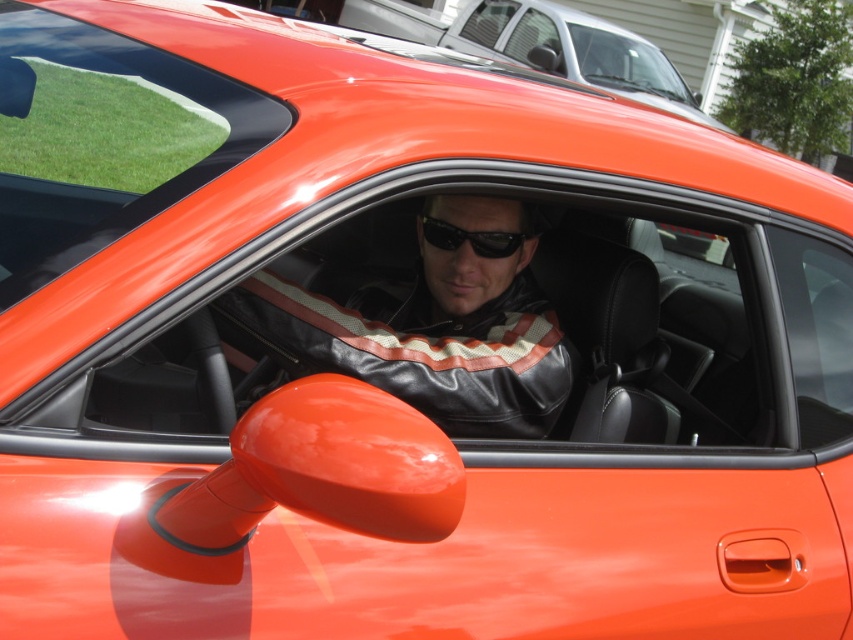
Question: In this image, where is leather jacket at center located relative to black matte sunglasses at center?

Choices:
 (A) left
 (B) right

Answer: (A)

Question: Can you confirm if leather jacket at center is smaller than black matte sunglasses at center?

Choices:
 (A) no
 (B) yes

Answer: (A)

Question: Is leather jacket at center to the left of black matte sunglasses at center from the viewer's perspective?

Choices:
 (A) no
 (B) yes

Answer: (B)

Question: Which point is farther to the camera?

Choices:
 (A) (498, 257)
 (B) (402, 333)

Answer: (A)

Question: Which point is farther to the camera?

Choices:
 (A) leather jacket at center
 (B) black matte sunglasses at center

Answer: (B)